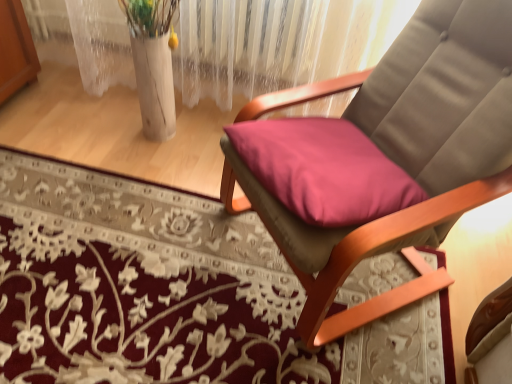
Question: Would you say matte pink cushion at center is inside or outside floral carpet at center?

Choices:
 (A) outside
 (B) inside

Answer: (A)

Question: Does point (463, 13) appear closer or farther from the camera than point (154, 337)?

Choices:
 (A) closer
 (B) farther

Answer: (A)

Question: Considering their positions, is matte pink cushion at center located in front of or behind floral carpet at center?

Choices:
 (A) front
 (B) behind

Answer: (A)

Question: From their relative heights in the image, would you say floral carpet at center is taller or shorter than matte pink cushion at center?

Choices:
 (A) tall
 (B) short

Answer: (B)

Question: Choose the correct answer: Is floral carpet at center inside matte pink cushion at center or outside it?

Choices:
 (A) outside
 (B) inside

Answer: (A)

Question: Is floral carpet at center in front of or behind matte pink cushion at center in the image?

Choices:
 (A) front
 (B) behind

Answer: (B)

Question: From the image's perspective, is floral carpet at center positioned above or below matte pink cushion at center?

Choices:
 (A) above
 (B) below

Answer: (B)